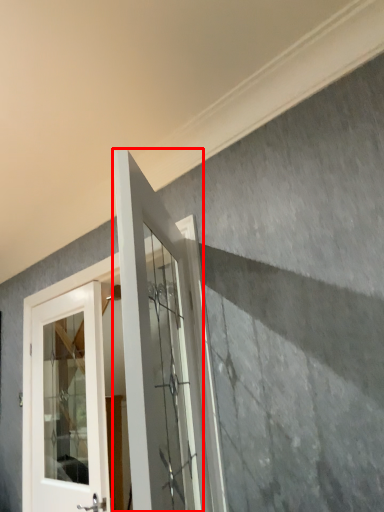
Question: From the image's perspective, what is the correct spatial relationship of door (annotated by the red box) in relation to door?

Choices:
 (A) above
 (B) below

Answer: (A)